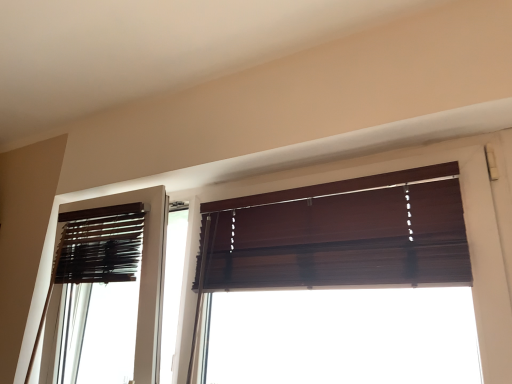
Question: Is brown matte blinds at left bigger than dark wood blinds at upper center?

Choices:
 (A) no
 (B) yes

Answer: (A)

Question: Is brown matte blinds at left thinner than dark wood blinds at upper center?

Choices:
 (A) yes
 (B) no

Answer: (B)

Question: Can you confirm if brown matte blinds at left is positioned to the right of dark wood blinds at upper center?

Choices:
 (A) yes
 (B) no

Answer: (B)

Question: Is dark wood blinds at upper center at the back of brown matte blinds at left?

Choices:
 (A) no
 (B) yes

Answer: (A)

Question: Does brown matte blinds at left have a greater height compared to dark wood blinds at upper center?

Choices:
 (A) yes
 (B) no

Answer: (B)

Question: Is brown matte blinds at left positioned beyond the bounds of dark wood blinds at upper center?

Choices:
 (A) no
 (B) yes

Answer: (B)

Question: Is dark wood blinds at upper center at the left side of brown matte blinds at left?

Choices:
 (A) no
 (B) yes

Answer: (A)

Question: From a real-world perspective, is dark wood blinds at upper center on brown matte blinds at left?

Choices:
 (A) no
 (B) yes

Answer: (B)

Question: Is dark wood blinds at upper center far from brown matte blinds at left?

Choices:
 (A) yes
 (B) no

Answer: (B)

Question: Are dark wood blinds at upper center and brown matte blinds at left making contact?

Choices:
 (A) no
 (B) yes

Answer: (A)

Question: Is brown matte blinds at left surrounded by dark wood blinds at upper center?

Choices:
 (A) yes
 (B) no

Answer: (B)

Question: Is dark wood blinds at upper center closer to the viewer compared to brown matte blinds at left?

Choices:
 (A) no
 (B) yes

Answer: (B)

Question: Is brown matte blinds at left wider or thinner than dark wood blinds at upper center?

Choices:
 (A) wide
 (B) thin

Answer: (A)